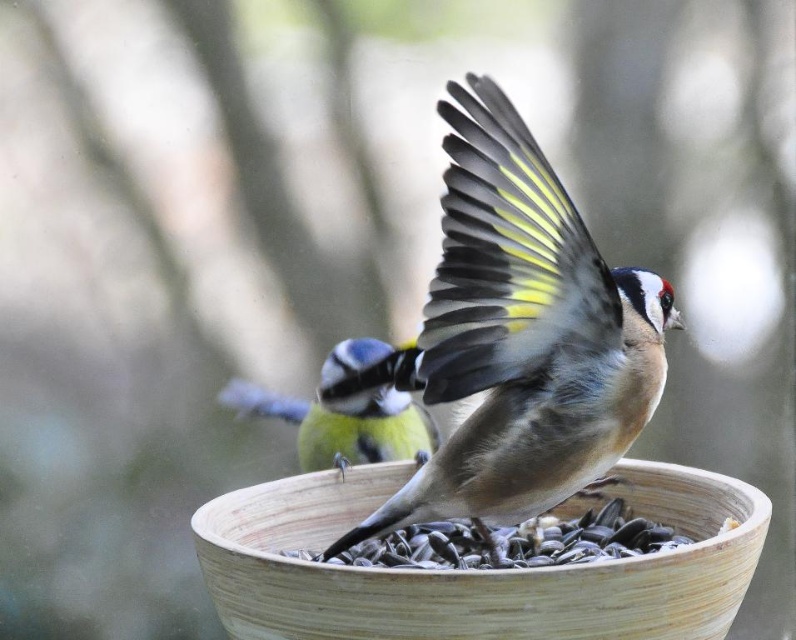
Question: Which is farther from the natural wood bowl at center?

Choices:
 (A) brown speckled feathers at center
 (B) blue-green feathered bird at center
 (C) brown matte seeds at center

Answer: (B)

Question: Is brown matte seeds at center positioned in front of blue-green feathered bird at center?

Choices:
 (A) yes
 (B) no

Answer: (A)

Question: Which point is farther from the camera taking this photo?

Choices:
 (A) (408, 564)
 (B) (240, 637)

Answer: (A)

Question: Is brown speckled feathers at center positioned in front of blue-green feathered bird at center?

Choices:
 (A) no
 (B) yes

Answer: (B)

Question: In this image, where is natural wood bowl at center located relative to blue-green feathered bird at center?

Choices:
 (A) above
 (B) below

Answer: (B)

Question: Which of the following is the closest to the observer?

Choices:
 (A) brown matte seeds at center
 (B) natural wood bowl at center
 (C) brown speckled feathers at center
 (D) blue-green feathered bird at center

Answer: (C)